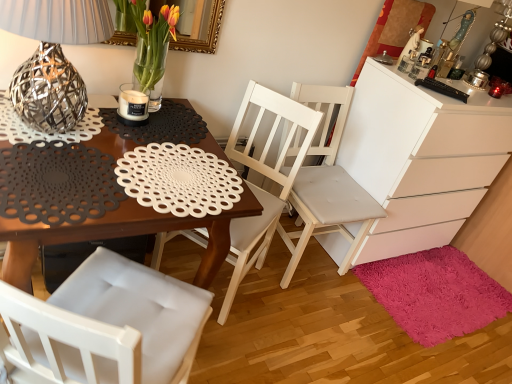
Question: Considering the relative positions of shaggy pink rug at lower right and white matte chest of drawers at right in the image provided, is shaggy pink rug at lower right to the left or to the right of white matte chest of drawers at right?

Choices:
 (A) left
 (B) right

Answer: (B)

Question: Considering their positions, is shaggy pink rug at lower right located in front of or behind white matte chest of drawers at right?

Choices:
 (A) behind
 (B) front

Answer: (A)

Question: Which object is the closest to the white matte candle at table?

Choices:
 (A) white matte chest of drawers at right
 (B) metallic wire ball at left
 (C) white wood chair at center, arranged as the second chair when viewed from the left
 (D) shaggy pink rug at lower right
 (E) matte glass vase with tulips at upper center

Answer: (E)

Question: Estimate the real-world distances between objects in this image. Which object is closer to the white matte chest of drawers at right?

Choices:
 (A) shaggy pink rug at lower right
 (B) white wood chair at center, the 1th chair from the right
 (C) metallic wire ball at left
 (D) white wood chair at center, the 1th chair viewed from the left
 (E) matte black placemat at center

Answer: (B)